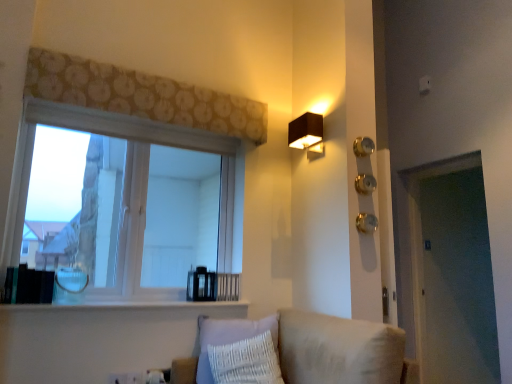
Question: Which direction should I rotate to face white plastic electric outlet at lower center, the first electric outlet positioned from the right, — up or down?

Choices:
 (A) down
 (B) up

Answer: (A)

Question: Is gold metallic knob at right, the third knob in the top-to-bottom sequence, taller than gold metallic knob at right, the second knob in the top-to-bottom sequence?

Choices:
 (A) no
 (B) yes

Answer: (A)

Question: Considering the relative positions of gold metallic knob at right, the first knob positioned from the bottom, and gold metallic knob at right, which is the second knob in bottom-to-top order, in the image provided, is gold metallic knob at right, the first knob positioned from the bottom, to the left of gold metallic knob at right, which is the second knob in bottom-to-top order, from the viewer's perspective?

Choices:
 (A) no
 (B) yes

Answer: (B)

Question: Is gold metallic knob at right, the first knob positioned from the bottom, positioned behind gold metallic knob at right, the second knob in the top-to-bottom sequence?

Choices:
 (A) no
 (B) yes

Answer: (A)

Question: Considering the relative positions of gold metallic knob at right, the third knob in the top-to-bottom sequence, and gold metallic knob at right, which is the second knob in bottom-to-top order, in the image provided, is gold metallic knob at right, the third knob in the top-to-bottom sequence, to the right of gold metallic knob at right, which is the second knob in bottom-to-top order, from the viewer's perspective?

Choices:
 (A) yes
 (B) no

Answer: (B)

Question: Is the position of gold metallic knob at right, the third knob in the top-to-bottom sequence, less distant than that of gold metallic knob at right, the second knob in the top-to-bottom sequence?

Choices:
 (A) yes
 (B) no

Answer: (A)

Question: Can we say gold metallic knob at right, the first knob positioned from the bottom, lies outside gold metallic knob at right, the second knob in the top-to-bottom sequence?

Choices:
 (A) yes
 (B) no

Answer: (A)

Question: From the image's perspective, does white wood window at upper left appear lower than beige fabric couch at lower center?

Choices:
 (A) no
 (B) yes

Answer: (A)

Question: Can you confirm if white wood window at upper left is shorter than beige fabric couch at lower center?

Choices:
 (A) yes
 (B) no

Answer: (B)

Question: From a real-world perspective, is white wood window at upper left below beige fabric couch at lower center?

Choices:
 (A) no
 (B) yes

Answer: (A)

Question: Does white wood window at upper left appear on the right side of beige fabric couch at lower center?

Choices:
 (A) no
 (B) yes

Answer: (A)

Question: Does white wood window at upper left have a lesser width compared to beige fabric couch at lower center?

Choices:
 (A) yes
 (B) no

Answer: (A)

Question: From a real-world perspective, is white wood window at upper left positioned over beige fabric couch at lower center based on gravity?

Choices:
 (A) yes
 (B) no

Answer: (A)

Question: Is black matte rectangular lamp at upper right positioned beyond the bounds of white glossy window sill at lower center?

Choices:
 (A) yes
 (B) no

Answer: (A)